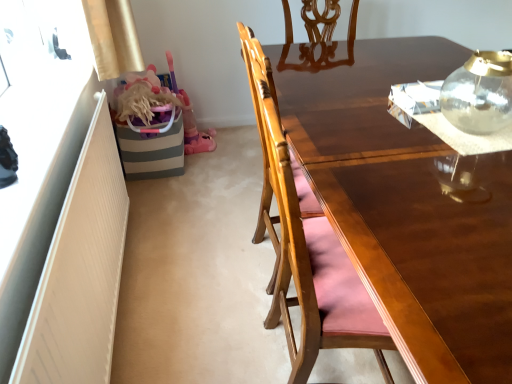
Question: Considering the relative sizes of transparent glass teapot at upper right and wooden chair at center in the image provided, is transparent glass teapot at upper right thinner than wooden chair at center?

Choices:
 (A) no
 (B) yes

Answer: (B)

Question: Is transparent glass teapot at upper right taller than wooden chair at center?

Choices:
 (A) yes
 (B) no

Answer: (B)

Question: Is transparent glass teapot at upper right facing towards wooden chair at center?

Choices:
 (A) no
 (B) yes

Answer: (A)

Question: Is transparent glass teapot at upper right outside of wooden chair at center?

Choices:
 (A) no
 (B) yes

Answer: (B)

Question: Considering the relative positions of transparent glass teapot at upper right and wooden chair at center in the image provided, is transparent glass teapot at upper right in front of wooden chair at center?

Choices:
 (A) no
 (B) yes

Answer: (B)

Question: From a real-world perspective, is transparent glass teapot at upper right physically below wooden chair at center?

Choices:
 (A) yes
 (B) no

Answer: (B)

Question: From a real-world perspective, is wooden chair at center physically below transparent glass teapot at upper right?

Choices:
 (A) yes
 (B) no

Answer: (A)

Question: From the image's perspective, is wooden chair at center beneath transparent glass teapot at upper right?

Choices:
 (A) yes
 (B) no

Answer: (A)

Question: From the image's perspective, does wooden chair at center appear higher than transparent glass teapot at upper right?

Choices:
 (A) no
 (B) yes

Answer: (A)

Question: Is wooden chair at center to the left of transparent glass teapot at upper right from the viewer's perspective?

Choices:
 (A) no
 (B) yes

Answer: (B)

Question: Is wooden chair at center in front of transparent glass teapot at upper right?

Choices:
 (A) yes
 (B) no

Answer: (B)

Question: Is wooden chair at center thinner than transparent glass teapot at upper right?

Choices:
 (A) yes
 (B) no

Answer: (B)

Question: From the image's perspective, is transparent glass teapot at upper right above or below wooden chair at center?

Choices:
 (A) below
 (B) above

Answer: (B)